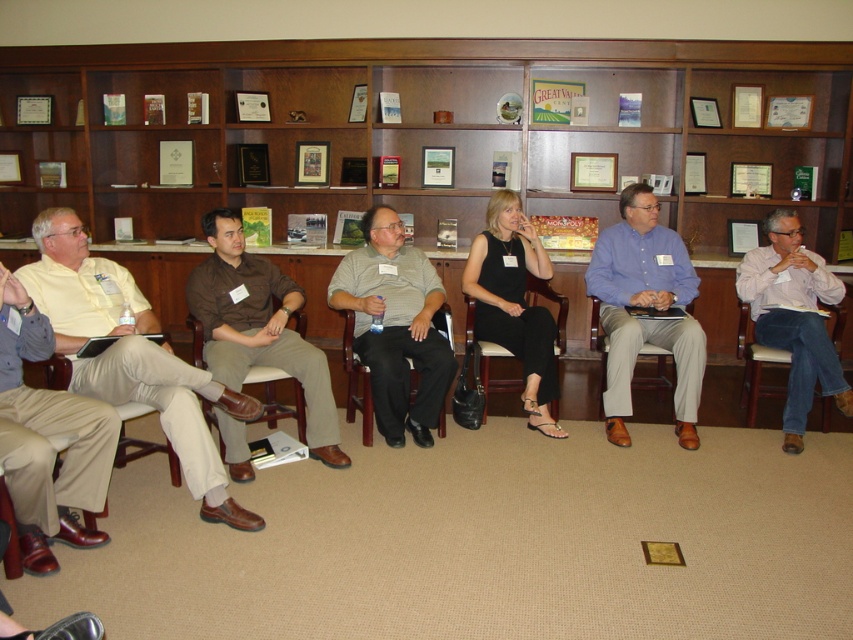
Question: Which of the following is the farthest from the observer?

Choices:
 (A) (763, 360)
 (B) (701, 227)

Answer: (B)

Question: Is wooden shelves at center to the right of gray striped shirt at center from the viewer's perspective?

Choices:
 (A) yes
 (B) no

Answer: (A)

Question: Can you confirm if matte khaki pants at left is smaller than tan fabric chair at center?

Choices:
 (A) no
 (B) yes

Answer: (A)

Question: Estimate the real-world distances between objects in this image. Which object is farther from the wooden shelves at center?

Choices:
 (A) leather armchair at lower left
 (B) black leather chair at center
 (C) brown leather chair at center

Answer: (A)

Question: Does brown cotton shirt at center appear over brown leather armchair at center?

Choices:
 (A) yes
 (B) no

Answer: (A)

Question: Among these objects, which one is nearest to the camera?

Choices:
 (A) brown cotton shirt at center
 (B) tan fabric chair at center
 (C) matte khaki pants at left
 (D) brown leather armchair at center

Answer: (C)